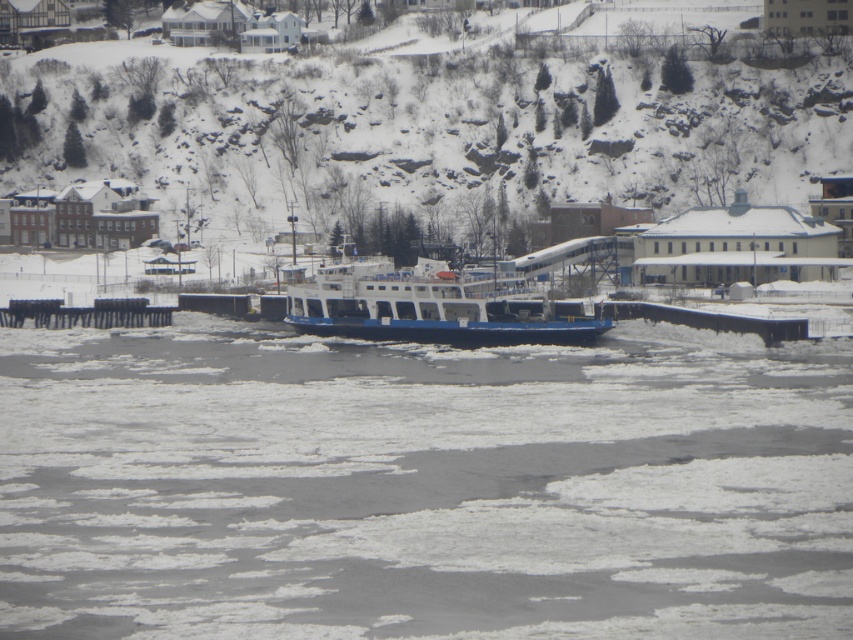
Question: Which point appears closest to the camera in this image?

Choices:
 (A) (451, 316)
 (B) (422, 116)
 (C) (363, 387)

Answer: (C)

Question: Is white ice at center below snowy rock at upper center?

Choices:
 (A) yes
 (B) no

Answer: (A)

Question: Which is farther from the white ice at center?

Choices:
 (A) blue matte ferry at center
 (B) snowy rock at upper center

Answer: (B)

Question: Can you confirm if snowy rock at upper center is bigger than blue matte ferry at center?

Choices:
 (A) yes
 (B) no

Answer: (A)

Question: Estimate the real-world distances between objects in this image. Which object is closer to the blue matte ferry at center?

Choices:
 (A) snowy rock at upper center
 (B) white ice at center

Answer: (B)

Question: Can you confirm if white ice at center is positioned to the left of snowy rock at upper center?

Choices:
 (A) no
 (B) yes

Answer: (A)